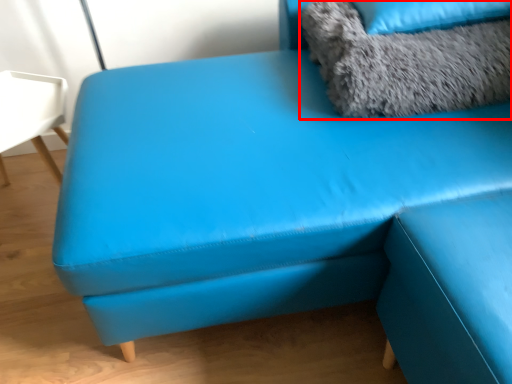
Question: From the image's perspective, where is animal (annotated by the red box) located in relation to pillow in the image?

Choices:
 (A) above
 (B) below

Answer: (B)